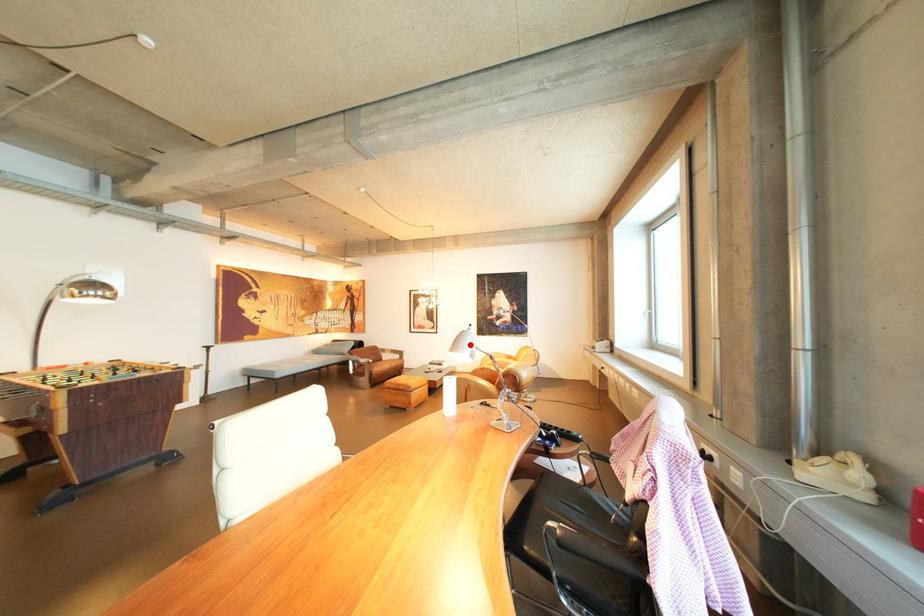
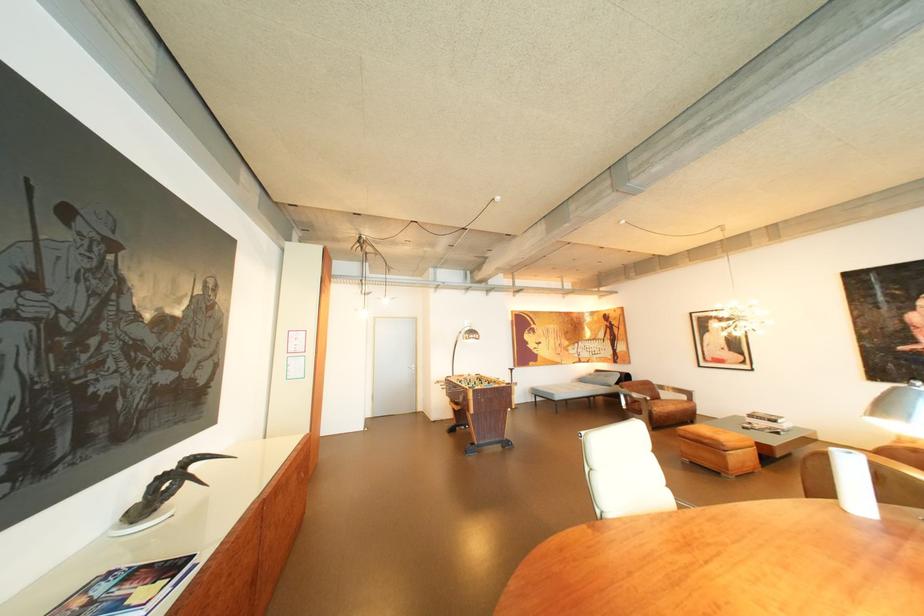
Locate, in the second image, the point that corresponds to the highlighted location in the first image.

(896, 407)